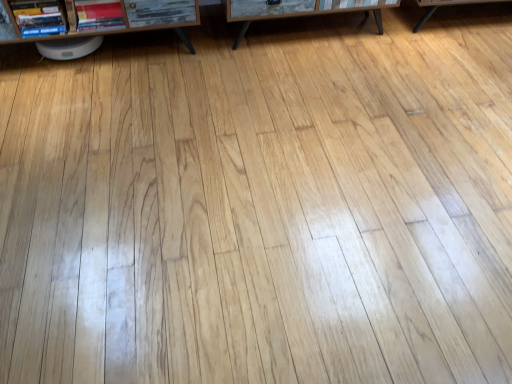
Question: Does wooden table at center appear on the left side of matte red book at left, the 2th book in the left-to-right sequence?

Choices:
 (A) yes
 (B) no

Answer: (B)

Question: Can you confirm if wooden table at center is wider than matte red book at left, the first book positioned from the right?

Choices:
 (A) yes
 (B) no

Answer: (A)

Question: Does wooden table at center come behind matte red book at left, the first book positioned from the right?

Choices:
 (A) yes
 (B) no

Answer: (A)

Question: From the image's perspective, does wooden table at center appear higher than matte red book at left, the first book positioned from the right?

Choices:
 (A) yes
 (B) no

Answer: (A)

Question: Is wooden table at center facing towards matte red book at left, the 2th book in the left-to-right sequence?

Choices:
 (A) no
 (B) yes

Answer: (A)

Question: Considering the relative sizes of wooden table at center and matte red book at left, the 2th book in the left-to-right sequence, in the image provided, is wooden table at center shorter than matte red book at left, the 2th book in the left-to-right sequence,?

Choices:
 (A) yes
 (B) no

Answer: (B)

Question: Is hardcover book at upper left, arranged as the 2th book when viewed from the right, shorter than matte red book at left, the first book positioned from the right?

Choices:
 (A) yes
 (B) no

Answer: (B)

Question: From a real-world perspective, is hardcover book at upper left, which ranks as the first book in left-to-right order, over matte red book at left, the first book positioned from the right?

Choices:
 (A) yes
 (B) no

Answer: (A)

Question: Is hardcover book at upper left, arranged as the 2th book when viewed from the right, bigger than matte red book at left, the first book positioned from the right?

Choices:
 (A) yes
 (B) no

Answer: (B)

Question: Can you confirm if hardcover book at upper left, which ranks as the first book in left-to-right order, is smaller than matte red book at left, the 2th book in the left-to-right sequence?

Choices:
 (A) no
 (B) yes

Answer: (B)

Question: Does hardcover book at upper left, which ranks as the first book in left-to-right order, have a greater height compared to matte red book at left, the 2th book in the left-to-right sequence?

Choices:
 (A) yes
 (B) no

Answer: (A)

Question: From a real-world perspective, is wooden table at center on brown wood shelf at upper left?

Choices:
 (A) no
 (B) yes

Answer: (A)